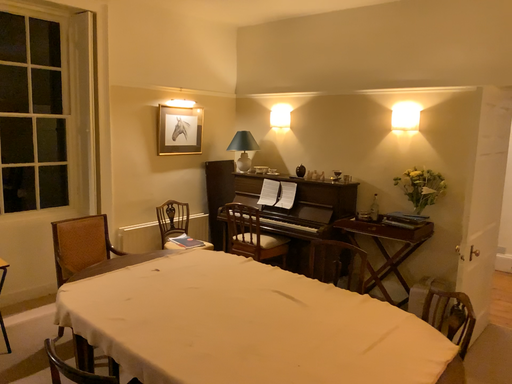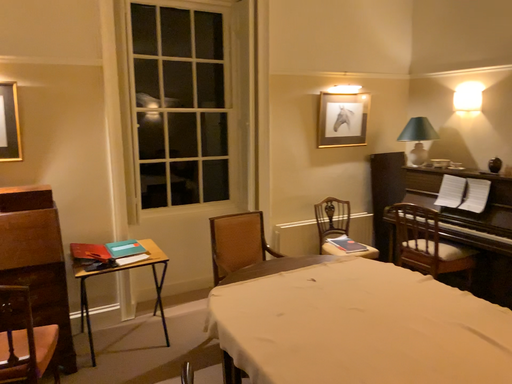
Question: Which way did the camera rotate in the video?

Choices:
 (A) rotated left
 (B) rotated right

Answer: (A)